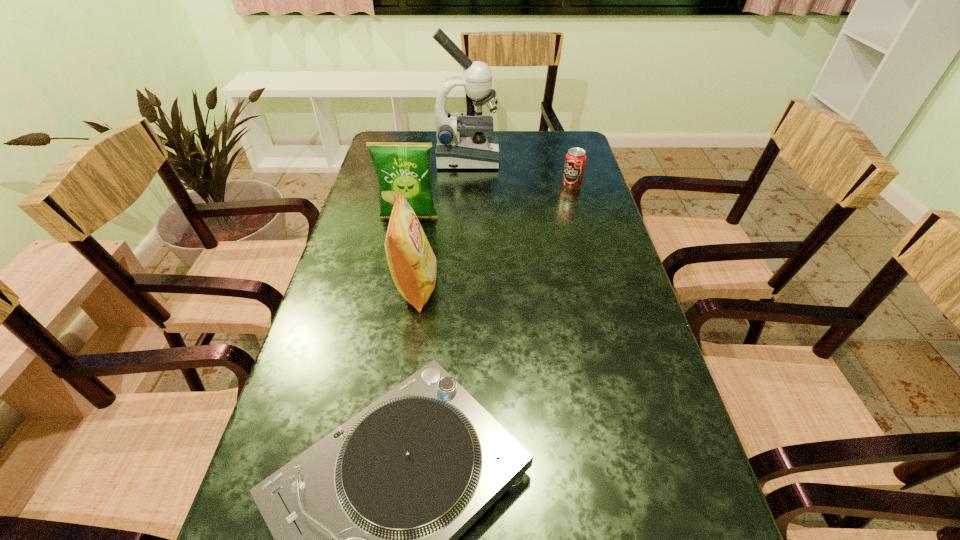
Identify the location of the tallest object. (456, 148).

This screenshot has width=960, height=540. Find the location of `microscope`. microscope is located at coordinates (456, 148).

Identify the location of the third farthest object. This screenshot has width=960, height=540. (406, 166).

Where is `the second nearest object`? The width and height of the screenshot is (960, 540). the second nearest object is located at coordinates (412, 263).

You are a GUI agent. You are given a task and a screenshot of the screen. Output one action in this format:
    pyautogui.click(x=<x>, y=<y>)
    Task: Click on the fourth tallest object
    This screenshot has width=960, height=540.
    Given the screenshot: What is the action you would take?
    pyautogui.click(x=575, y=159)

You are a GUI agent. You are given a task and a screenshot of the screen. Output one action in this format:
    pyautogui.click(x=<x>, y=<y>)
    Task: Click on the rightmost object
    
    Given the screenshot: What is the action you would take?
    pyautogui.click(x=575, y=159)

What are the coordinates of `vacant space situated on the front of the farthest object` in the screenshot? It's located at (466, 212).

Image resolution: width=960 pixels, height=540 pixels. Find the location of `vacant region located on the front-facing side of the farther crisp (potato chip)`. vacant region located on the front-facing side of the farther crisp (potato chip) is located at coordinates (396, 283).

Locate an element on the screen. Image resolution: width=960 pixels, height=540 pixels. vacant space located 0.150m on the front-facing side of the second nearest object is located at coordinates (498, 288).

At what (x,y) coordinates should I click in order to perform the action: click on vacant space positioned on the left of the rightmost object. Please return your answer as a coordinate pair (x, y). This screenshot has height=540, width=960. Looking at the image, I should click on (445, 185).